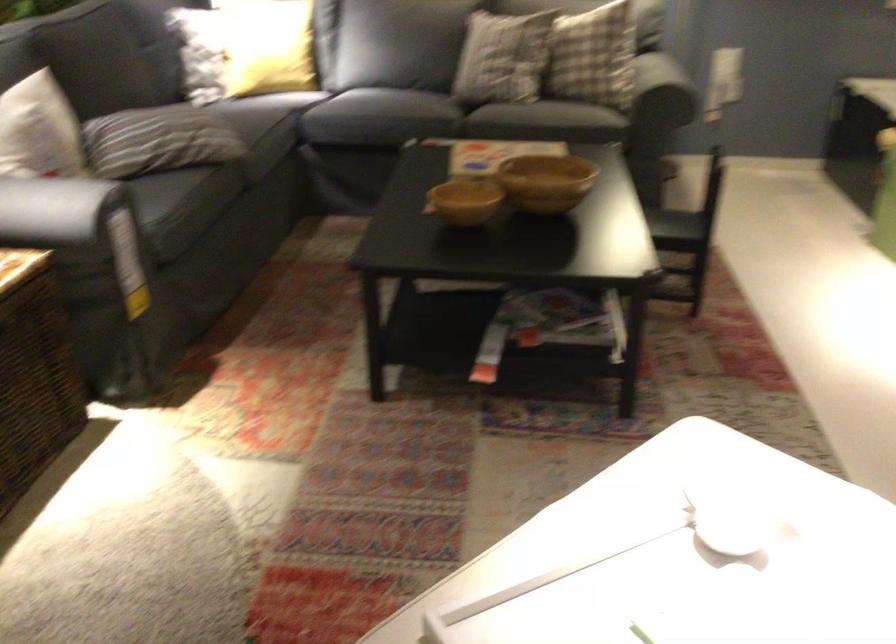
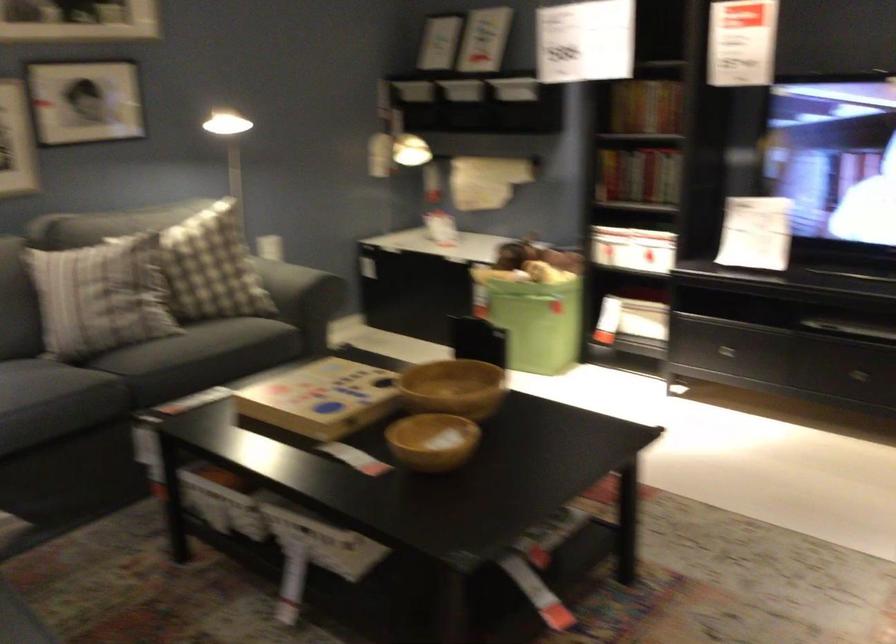
Locate, in the second image, the point that corresponds to the point at 563,180 in the first image.

(453, 388)